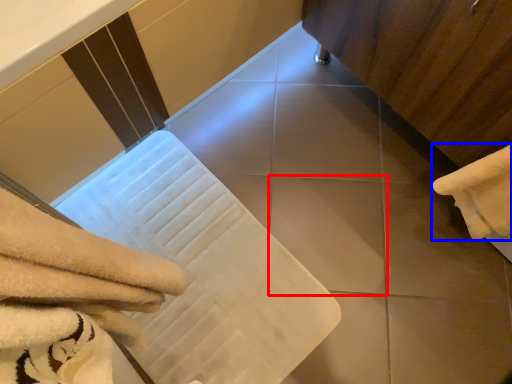
Question: Which object is further to the camera taking this photo, tile (highlighted by a red box) or towel (highlighted by a blue box)?

Choices:
 (A) tile
 (B) towel

Answer: (A)